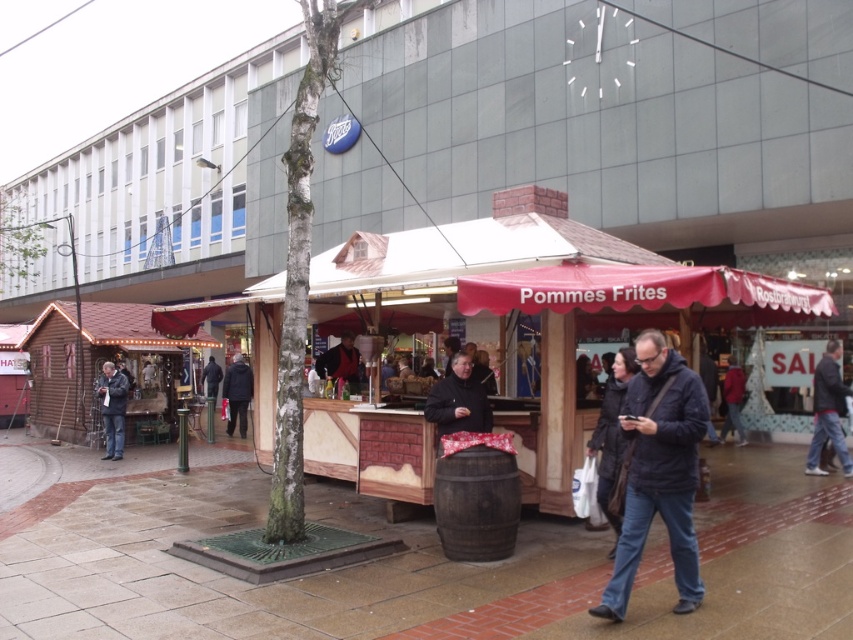
Does dark blue jacket at lower left appear on the left side of black fabric jacket at center?

Correct, you'll find dark blue jacket at lower left to the left of black fabric jacket at center.

Who is positioned more to the right, dark blue jacket at lower left or black fabric jacket at center?

black fabric jacket at center is more to the right.

Locate an element on the screen. This screenshot has width=853, height=640. dark blue jacket at lower left is located at coordinates (112, 408).

Locate an element on the screen. dark blue jacket at lower left is located at coordinates (112, 408).

Which is more to the right, black fabric jacket at center or dark brown leather jacket at center?

Positioned to the right is dark brown leather jacket at center.

Does black fabric jacket at center appear on the left side of dark brown leather jacket at center?

Correct, you'll find black fabric jacket at center to the left of dark brown leather jacket at center.

Which is in front, point (228, 426) or point (340, 362)?

Positioned in front is point (340, 362).

Where is `black fabric jacket at center`? The image size is (853, 640). black fabric jacket at center is located at coordinates (236, 394).

Between dark blue jeans at lower right and dark brown leather jacket at center, which one appears on the right side from the viewer's perspective?

dark blue jeans at lower right is more to the right.

Who is more forward, (x=814, y=428) or (x=316, y=369)?

Point (x=814, y=428) is in front.

Does point (820, 426) come in front of point (347, 362)?

Yes, point (820, 426) is closer to viewer.

Where is `dark blue jeans at lower right`? The image size is (853, 640). dark blue jeans at lower right is located at coordinates (828, 412).